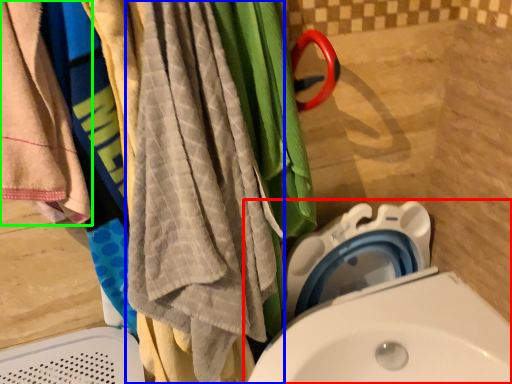
Question: Which is farther away from toilet (highlighted by a red box)? beach towel (highlighted by a blue box) or towel (highlighted by a green box)?

Choices:
 (A) beach towel
 (B) towel

Answer: (B)